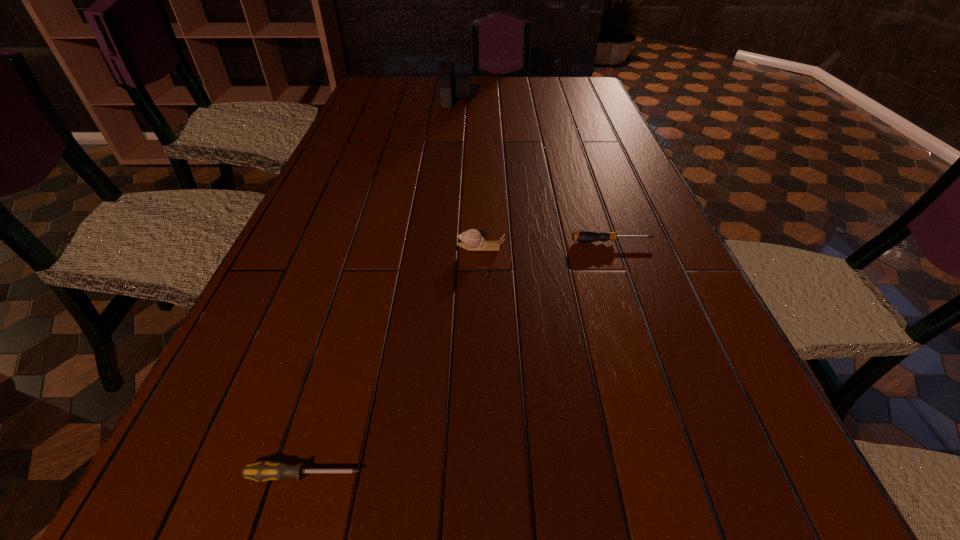
In order to click on free space located on the shell of the second tallest object in this screenshot , I will do `click(391, 248)`.

Identify the location of vacant space located 0.220m on the front of the right screwdriver. This screenshot has width=960, height=540. (638, 317).

Locate an element on the screen. Image resolution: width=960 pixels, height=540 pixels. free space located at the tip of the nearest object is located at coordinates (639, 476).

The width and height of the screenshot is (960, 540). Find the location of `object that is at the far edge`. object that is at the far edge is located at coordinates (459, 87).

The height and width of the screenshot is (540, 960). Find the location of `object at the left edge`. object at the left edge is located at coordinates (265, 470).

Image resolution: width=960 pixels, height=540 pixels. I want to click on object present at the right edge, so click(x=584, y=236).

Locate an element on the screen. vacant space at the left edge of the desktop is located at coordinates (309, 246).

This screenshot has height=540, width=960. In order to click on vacant space at the right edge in this screenshot , I will do `click(625, 240)`.

The height and width of the screenshot is (540, 960). Identify the location of free space at the far left corner of the desktop. (375, 92).

Locate an element on the screen. The width and height of the screenshot is (960, 540). vacant space at the far right corner of the desktop is located at coordinates (579, 82).